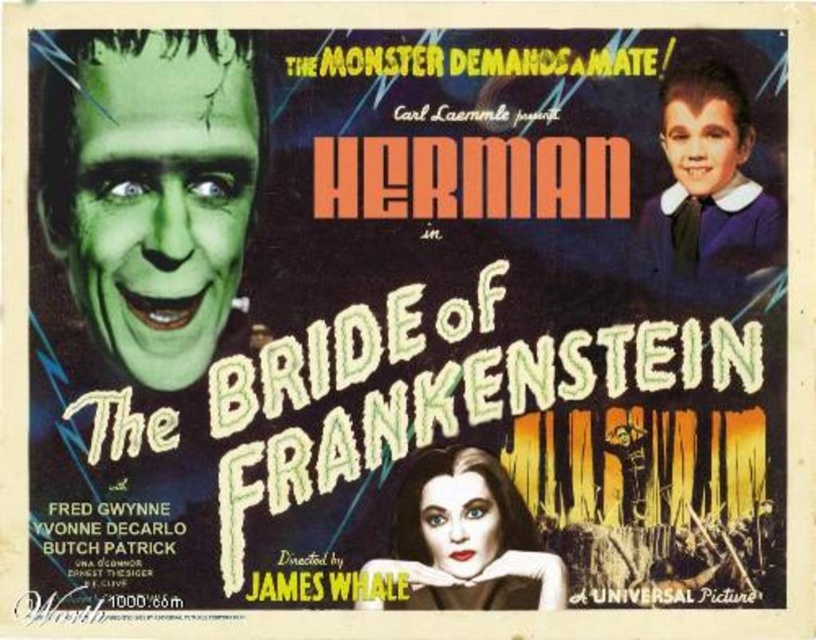
Does point (112, 285) come farther from viewer compared to point (431, 452)?

No, (112, 285) is in front of (431, 452).

Between point (251, 168) and point (415, 476), which one is positioned in front?

Point (251, 168) is in front.

Is point (60, 180) positioned before point (408, 476)?

Yes, point (60, 180) is closer to viewer.

You are a GUI agent. You are given a task and a screenshot of the screen. Output one action in this format:
    pyautogui.click(x=<x>, y=<y>)
    Task: Click on the green matte face at left
    This screenshot has height=640, width=816.
    Given the screenshot: What is the action you would take?
    pyautogui.click(x=151, y=188)

Which is more to the left, green matte face at left or purple matte shirt at upper right?

green matte face at left

Is green matte face at left wider than purple matte shirt at upper right?

Indeed, green matte face at left has a greater width compared to purple matte shirt at upper right.

Is point (109, 209) closer to viewer compared to point (683, 168)?

Yes, point (109, 209) is in front of point (683, 168).

At what (x,y) coordinates should I click in order to perform the action: click on green matte face at left. Please return your answer as a coordinate pair (x, y). The width and height of the screenshot is (816, 640). Looking at the image, I should click on (151, 188).

Can you confirm if purple matte shirt at upper right is wider than smooth black hair at center?

In fact, purple matte shirt at upper right might be narrower than smooth black hair at center.

Image resolution: width=816 pixels, height=640 pixels. What do you see at coordinates (707, 192) in the screenshot?
I see `purple matte shirt at upper right` at bounding box center [707, 192].

Who is more distant from viewer, (695, 195) or (431, 497)?

The point (695, 195) is behind.

I want to click on purple matte shirt at upper right, so click(x=707, y=192).